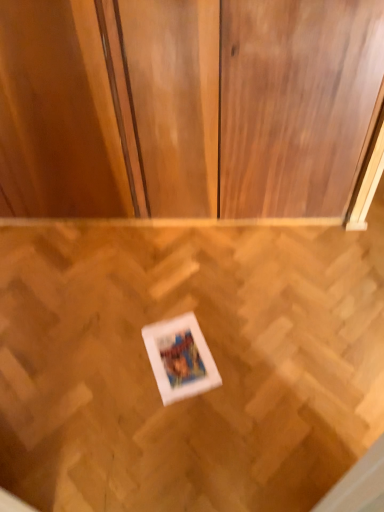
I want to click on free spot above wooden parquet floor at center (from a real-world perspective), so click(176, 324).